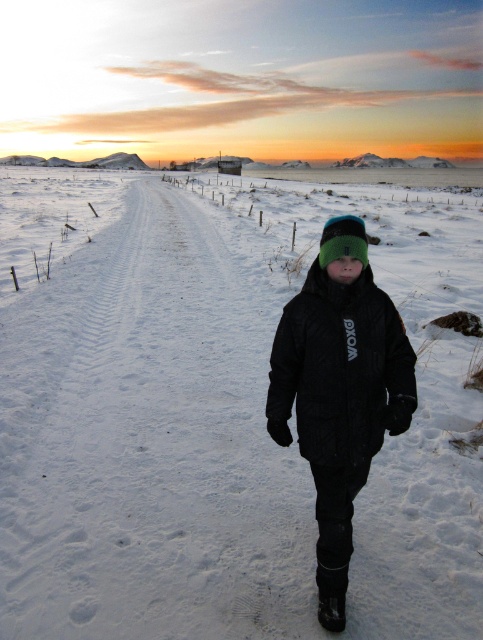
Who is more forward, (385, 269) or (337, 230)?

Point (337, 230) is more forward.

The height and width of the screenshot is (640, 483). What do you see at coordinates (174, 397) in the screenshot?
I see `white fluffy snow at center` at bounding box center [174, 397].

This screenshot has height=640, width=483. What do you see at coordinates (174, 397) in the screenshot? I see `white fluffy snow at center` at bounding box center [174, 397].

Identify the location of white fluffy snow at center. This screenshot has width=483, height=640. (174, 397).

Who is positioned more to the right, white fluffy snow at center or black quilted jacket at center?

From the viewer's perspective, black quilted jacket at center appears more on the right side.

Describe the element at coordinates (174, 397) in the screenshot. The image size is (483, 640). I see `white fluffy snow at center` at that location.

Find the location of a particular element. This screenshot has width=483, height=640. white fluffy snow at center is located at coordinates (174, 397).

Who is positioned more to the right, black quilted jacket at center or green knit hat at center?

From the viewer's perspective, green knit hat at center appears more on the right side.

Is black quilted jacket at center taller than green knit hat at center?

Yes.

Which is in front, point (316, 339) or point (356, 236)?

Positioned in front is point (356, 236).

Find the location of a particular element. black quilted jacket at center is located at coordinates (340, 369).